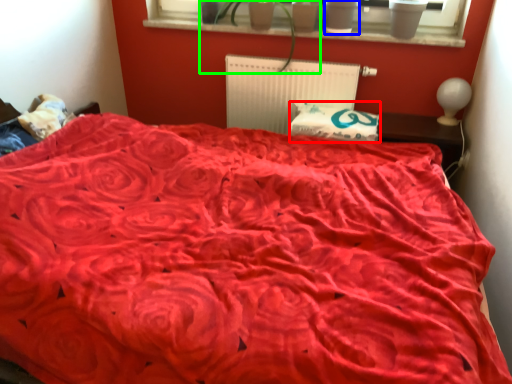
Question: Estimate the real-world distances between objects in this image. Which object is closer to pillow (highlighted by a red box), flowerpot (highlighted by a blue box) or houseplant (highlighted by a green box)?

Choices:
 (A) flowerpot
 (B) houseplant

Answer: (B)